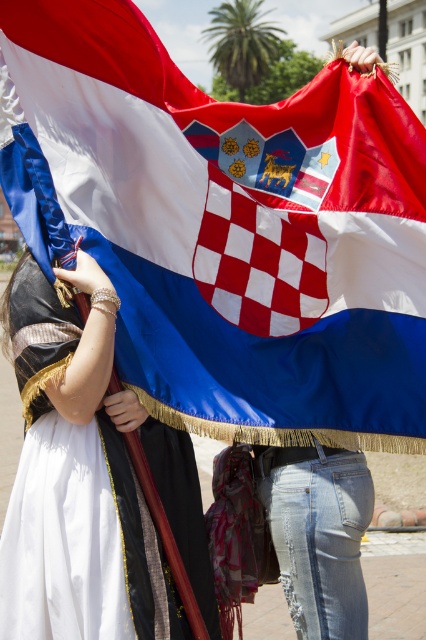
You are a photographer trying to capture the silky fabric flag at center in your shot. The flag is located at coordinates point 0.358, 0.538. If your camera frame is centered at point 0.5, 0.5, will the flag be centered in your photo?

The silky fabric flag at center is positioned at point (229, 228), which is slightly to the left and below the camera frame center at (213, 320). Therefore, the flag will not be perfectly centered in the photo.

In the scene shown: You are a photographer standing 5 feet away from the silky fabric flag at center. You want to take a photo of the matte black dress at left without the flag blocking it. Can you move closer to the dress to achieve this?

The distance between the silky fabric flag at center and the matte black dress at left is 3.46 feet. Since you are currently 5 feet away from the flag, you need to move 1.54 feet closer to the dress to be within the 3.46 feet distance, but this might still leave the flag in the frame. Alternatively, moving to the side could avoid the flag blocking the dress.